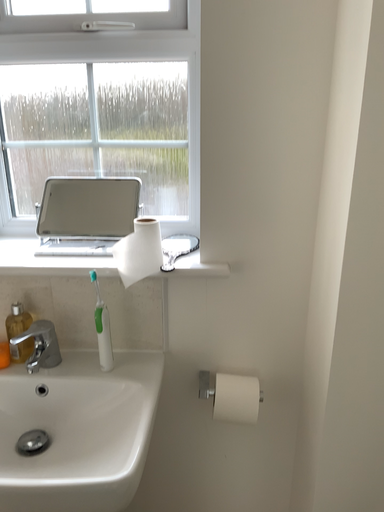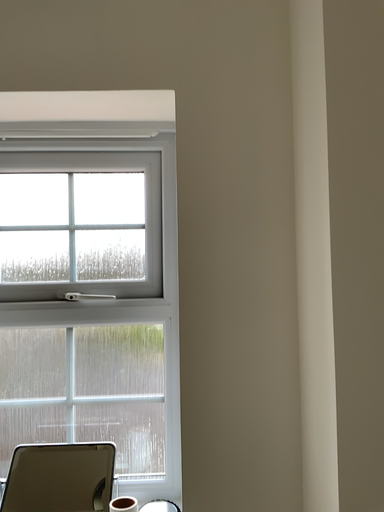
Question: Which way did the camera rotate in the video?

Choices:
 (A) rotated downward
 (B) rotated upward

Answer: (B)